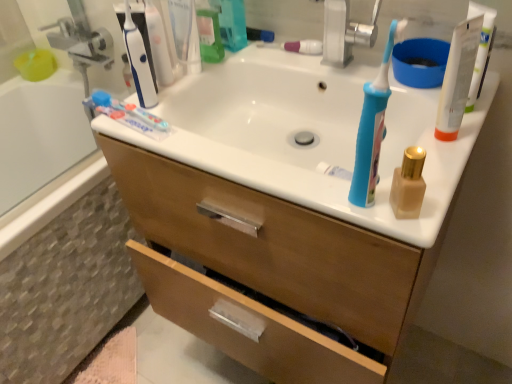
Question: Does matte gold bottle at right lie behind white glossy toothpaste at upper left, which is counted as the second toothpaste, starting from the top?

Choices:
 (A) yes
 (B) no

Answer: (B)

Question: Is matte gold bottle at right at the right side of white glossy toothpaste at upper left, which is the first toothpaste in left-to-right order?

Choices:
 (A) yes
 (B) no

Answer: (A)

Question: Is matte gold bottle at right wider than white glossy toothpaste at upper left, which is the first toothpaste in left-to-right order?

Choices:
 (A) yes
 (B) no

Answer: (B)

Question: Is matte gold bottle at right smaller than white glossy toothpaste at upper left, the first toothpaste ordered from the bottom?

Choices:
 (A) yes
 (B) no

Answer: (A)

Question: From a real-world perspective, is matte gold bottle at right located higher than white glossy toothpaste at upper left, positioned as the 1th toothpaste in front-to-back order?

Choices:
 (A) no
 (B) yes

Answer: (B)

Question: From the image's perspective, is blue plastic toothbrush at upper right above or below white plastic tube at upper right?

Choices:
 (A) below
 (B) above

Answer: (A)

Question: Is blue plastic toothbrush at upper right bigger or smaller than white plastic tube at upper right?

Choices:
 (A) small
 (B) big

Answer: (B)

Question: Considering the positions of point (376, 99) and point (441, 117), is point (376, 99) closer or farther from the camera than point (441, 117)?

Choices:
 (A) closer
 (B) farther

Answer: (A)

Question: From a real-world perspective, is blue plastic toothbrush at upper right positioned above or below white plastic tube at upper right?

Choices:
 (A) below
 (B) above

Answer: (B)

Question: Based on their sizes in the image, would you say white plastic tube at upper right is bigger or smaller than silver metallic faucet at upper center?

Choices:
 (A) small
 (B) big

Answer: (A)

Question: Considering the positions of white plastic tube at upper right and silver metallic faucet at upper center in the image, is white plastic tube at upper right wider or thinner than silver metallic faucet at upper center?

Choices:
 (A) wide
 (B) thin

Answer: (B)

Question: In the image, is white plastic tube at upper right positioned in front of or behind silver metallic faucet at upper center?

Choices:
 (A) behind
 (B) front

Answer: (B)

Question: Is white plastic tube at upper right spatially inside silver metallic faucet at upper center, or outside of it?

Choices:
 (A) inside
 (B) outside

Answer: (B)

Question: Is white plastic tube at upper right situated inside pink glossy toothpaste at center, arranged as the second toothpaste when viewed from the left, or outside?

Choices:
 (A) inside
 (B) outside

Answer: (B)

Question: In terms of height, does white plastic tube at upper right look taller or shorter compared to pink glossy toothpaste at center, the first toothpaste from the back?

Choices:
 (A) short
 (B) tall

Answer: (B)